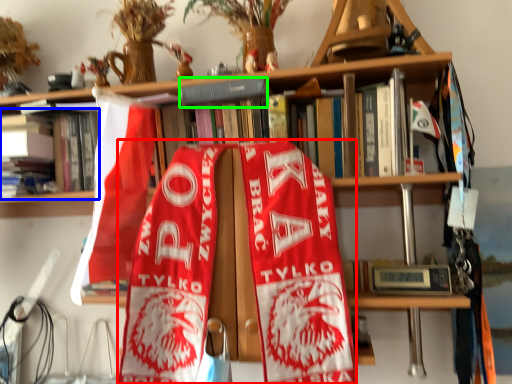
Question: Based on their relative distances, which object is farther from beach towel (highlighted by a red box)? Choose from book (highlighted by a blue box) and book (highlighted by a green box).

Choices:
 (A) book
 (B) book

Answer: (A)